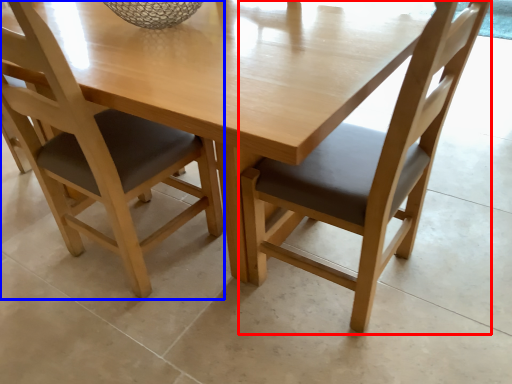
Question: Which of the following is the closest to the observer, chair (highlighted by a red box) or chair (highlighted by a blue box)?

Choices:
 (A) chair
 (B) chair

Answer: (A)